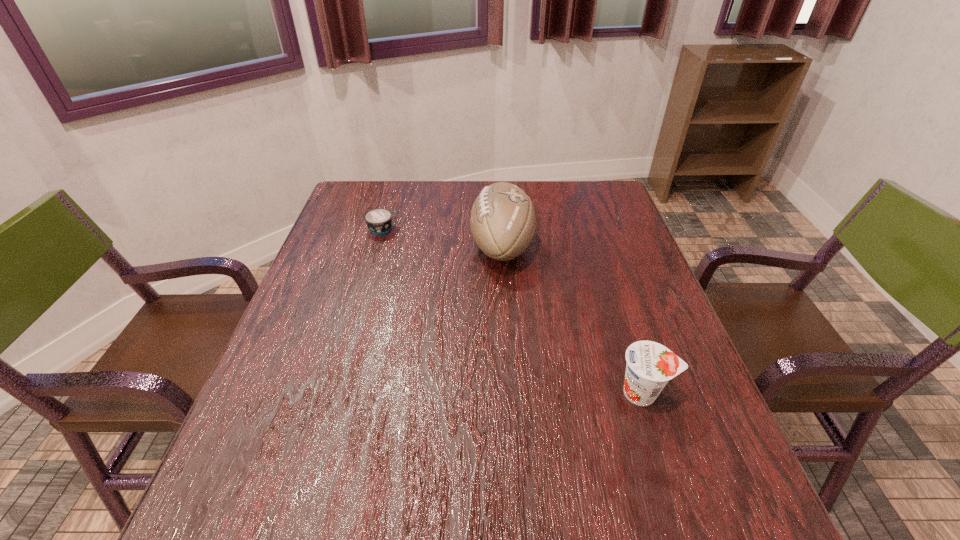
What are the coordinates of `the tallest object` in the screenshot? It's located at (502, 220).

Locate an element on the screen. This screenshot has height=540, width=960. the second object from right to left is located at coordinates (502, 220).

Identify the location of the nearest object. (650, 365).

At what (x,y) coordinates should I click in order to perform the action: click on the second tallest object. Please return your answer as a coordinate pair (x, y). The image size is (960, 540). Looking at the image, I should click on (650, 365).

I want to click on the leftmost object, so click(x=379, y=220).

Find the location of a particular element. This screenshot has width=960, height=540. the left yogurt is located at coordinates (379, 220).

The width and height of the screenshot is (960, 540). I want to click on vacant space located on the laces of the football (American), so click(x=378, y=246).

Where is `free space located 0.080m on the laces of the football (American)`? free space located 0.080m on the laces of the football (American) is located at coordinates (442, 246).

I want to click on free location located on the laces of the football (American), so click(x=396, y=246).

You are a GUI agent. You are given a task and a screenshot of the screen. Output one action in this format:
    pyautogui.click(x=<x>, y=<y>)
    Task: Click on the vacant space located on the left of the right yogurt
    Image resolution: width=960 pixels, height=540 pixels.
    Given the screenshot: What is the action you would take?
    pyautogui.click(x=486, y=393)